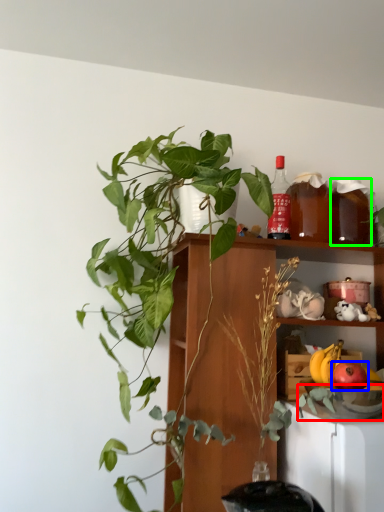
Question: Which object is the closest to the glass bowl (highlighted by a red box)? Choose among these: apple (highlighted by a blue box) or beverage (highlighted by a green box).

Choices:
 (A) apple
 (B) beverage

Answer: (A)